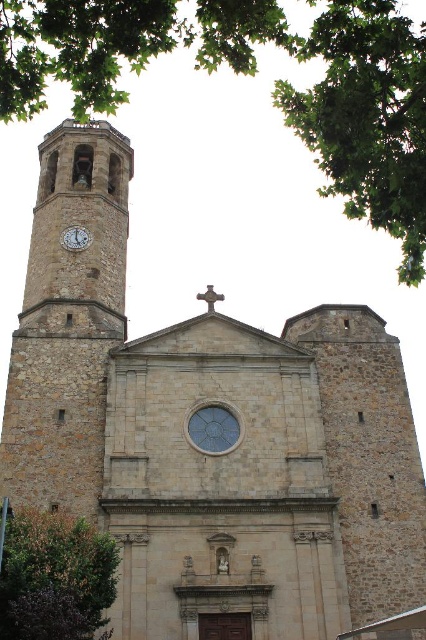
Who is positioned more to the left, stone clock tower at left or metallic clock at upper left?

stone clock tower at left is more to the left.

Who is more distant from viewer, (x=94, y=177) or (x=66, y=240)?

Point (x=94, y=177)

I want to click on stone clock tower at left, so click(68, 321).

Does green leafy tree at upper left appear on the left side of green leafy tree at lower left?

In fact, green leafy tree at upper left is to the right of green leafy tree at lower left.

You are a GUI agent. You are given a task and a screenshot of the screen. Output one action in this format:
    pyautogui.click(x=<x>, y=<y>)
    Task: Click on the green leafy tree at upper left
    
    Given the screenshot: What is the action you would take?
    pyautogui.click(x=250, y=74)

You are a GUI agent. You are given a task and a screenshot of the screen. Output one action in this format:
    pyautogui.click(x=<x>, y=<y>)
    Task: Click on the green leafy tree at upper left
    Image resolution: width=426 pixels, height=640 pixels.
    Given the screenshot: What is the action you would take?
    pyautogui.click(x=250, y=74)

You are a GUI agent. You are given a task and a screenshot of the screen. Output one action in this format:
    pyautogui.click(x=<x>, y=<y>)
    Task: Click on the green leafy tree at upper left
    The height and width of the screenshot is (640, 426).
    Given the screenshot: What is the action you would take?
    [250, 74]

Can you confirm if green leafy tree at upper left is taller than stone clock tower at left?

Indeed, green leafy tree at upper left has a greater height compared to stone clock tower at left.

Can you confirm if green leafy tree at upper left is bigger than stone clock tower at left?

Indeed, green leafy tree at upper left has a larger size compared to stone clock tower at left.

Is point (89, 28) more distant than point (89, 157)?

No, (89, 28) is closer to viewer.

In order to click on green leafy tree at upper left in this screenshot , I will do `click(250, 74)`.